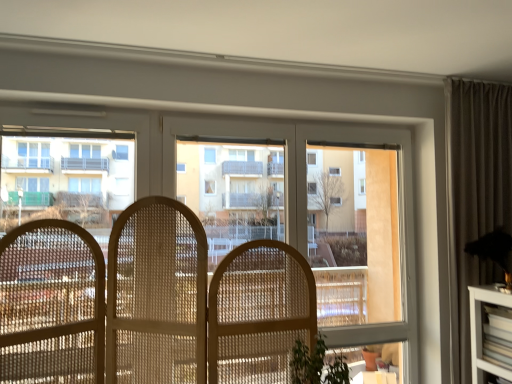
Question: Is transparent glass window at center thinner than transparent glass bay window at center?

Choices:
 (A) yes
 (B) no

Answer: (A)

Question: Is transparent glass window at center turned away from transparent glass bay window at center?

Choices:
 (A) yes
 (B) no

Answer: (A)

Question: Considering the relative sizes of transparent glass window at center and transparent glass bay window at center in the image provided, is transparent glass window at center shorter than transparent glass bay window at center?

Choices:
 (A) yes
 (B) no

Answer: (B)

Question: Is transparent glass window at center positioned far away from transparent glass bay window at center?

Choices:
 (A) yes
 (B) no

Answer: (B)

Question: From a real-world perspective, is transparent glass window at center located higher than transparent glass bay window at center?

Choices:
 (A) yes
 (B) no

Answer: (B)

Question: Is transparent glass window at center situated inside white glossy building at left or outside?

Choices:
 (A) inside
 (B) outside

Answer: (B)

Question: Does point (411, 370) appear closer or farther from the camera than point (122, 155)?

Choices:
 (A) farther
 (B) closer

Answer: (A)

Question: From the image's perspective, is transparent glass window at center positioned above or below white glossy building at left?

Choices:
 (A) above
 (B) below

Answer: (B)

Question: Is transparent glass window at center taller or shorter than white glossy building at left?

Choices:
 (A) tall
 (B) short

Answer: (A)

Question: In terms of height, does white glossy building at left look taller or shorter compared to transparent glass bay window at center?

Choices:
 (A) short
 (B) tall

Answer: (A)

Question: Choose the correct answer: Is white glossy building at left inside transparent glass bay window at center or outside it?

Choices:
 (A) inside
 (B) outside

Answer: (B)

Question: Relative to transparent glass bay window at center, is white glossy building at left in front or behind?

Choices:
 (A) front
 (B) behind

Answer: (A)

Question: Based on their sizes in the image, would you say white glossy building at left is bigger or smaller than transparent glass bay window at center?

Choices:
 (A) big
 (B) small

Answer: (B)

Question: Considering the positions of transparent glass window at center and transparent glass bay window at center in the image, is transparent glass window at center bigger or smaller than transparent glass bay window at center?

Choices:
 (A) big
 (B) small

Answer: (A)

Question: Based on their positions, is transparent glass window at center located to the left or right of transparent glass bay window at center?

Choices:
 (A) right
 (B) left

Answer: (A)